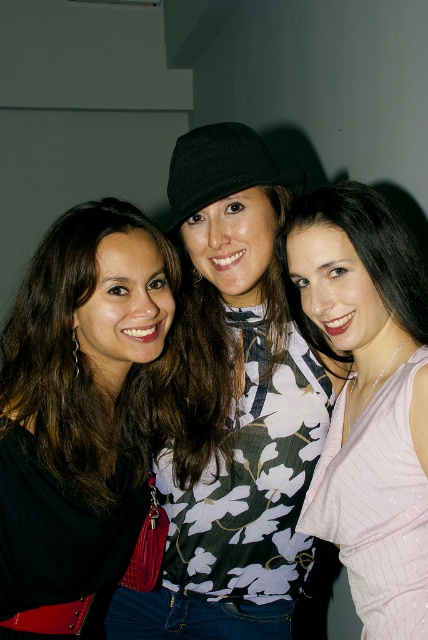
You are standing in the same room as the three women in the image. There are two points marked in the scene. The first point is at coordinates point (222, 218) and the second is at point (95, 433). Which point is closer to you?

Point (222, 218) is in front of point (95, 433), so it is closer to you.